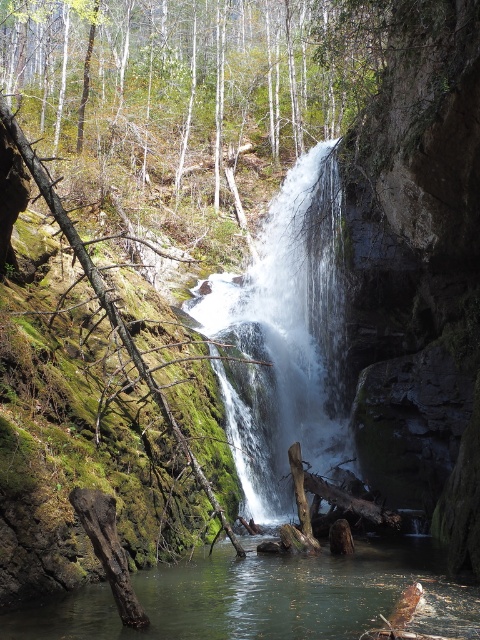
You are a hiker who wants to cross the clear water at center. There is a green mossy tree at center nearby. Which direction should you walk to reach the tree from the water?

The green mossy tree at center is to the left of clear water at center, so you should walk to the left to reach the tree from the water.

You are standing at the edge of the pool and want to reach the green mossy tree at center. Which direction should you walk to get there from the white frothy water at center?

You should walk to the left from the white frothy water at center to reach the green mossy tree at center because the green mossy tree at center is located to the left of the white frothy water at center.